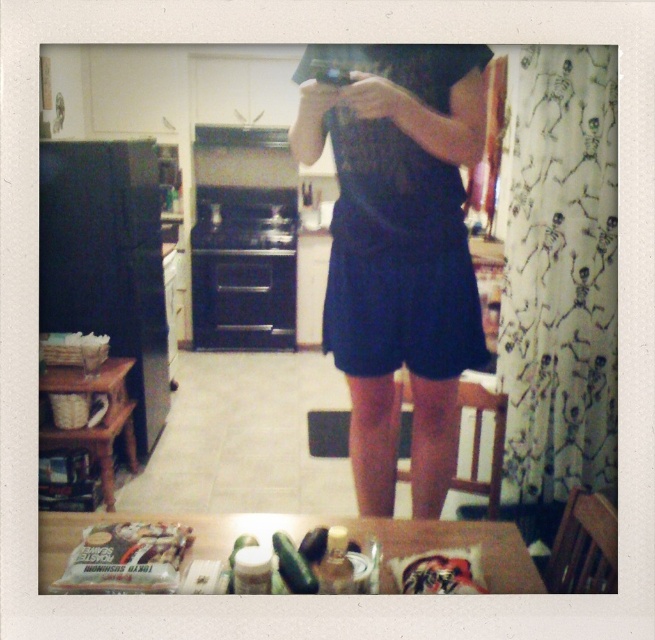
You are standing in the kitchen and see your reflection in the mirror. You want to reach for the white matte bag of almond butter at lower left without moving your feet. Can you do this while keeping your dark blue fabric dress at center visible in the mirror?

The dark blue fabric dress at center is further to the viewer than the white matte bag of almond butter at lower left. Since the dress is closer to you, you can reach for the almond butter bag without moving your feet while still keeping the dress visible in the mirror.

You are organizing items in the kitchen and need to place the white matte bag of almond butter at lower left. Where should you place it so it doesn not block the view of the dark blue fabric dress at center?

Since the dark blue fabric dress at center is to the right of the white matte bag of almond butter at lower left, placing the white matte bag of almond butter at lower left to the left side of the kitchen would keep it out of the dresss view.